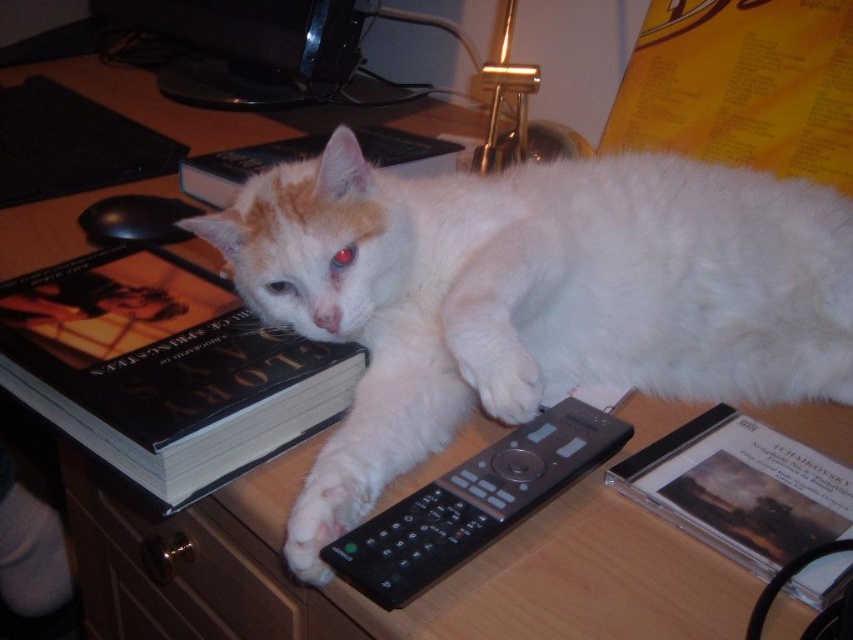
Which is below, matte plastic cd case at lower right or black plastic remote at center?

matte plastic cd case at lower right

Is matte plastic cd case at lower right smaller than black plastic remote at center?

Yes.

Between point (654, 506) and point (418, 515), which one is positioned behind?

The point (654, 506) is behind.

Find the location of a particular element. Image resolution: width=853 pixels, height=640 pixels. matte plastic cd case at lower right is located at coordinates (740, 488).

Who is positioned more to the left, black hardcover book at upper left or matte plastic cd case at lower right?

black hardcover book at upper left is more to the left.

Does black hardcover book at upper left appear on the right side of matte plastic cd case at lower right?

No, black hardcover book at upper left is not to the right of matte plastic cd case at lower right.

Which is in front, point (131, 460) or point (770, 467)?

Point (131, 460) is in front.

Where is `black hardcover book at upper left`? The height and width of the screenshot is (640, 853). black hardcover book at upper left is located at coordinates (164, 369).

Describe the element at coordinates (740, 488) in the screenshot. The height and width of the screenshot is (640, 853). I see `matte plastic cd case at lower right` at that location.

Is matte plastic cd case at lower right smaller than hardcover book at upper left?

Yes.

Where is `matte plastic cd case at lower right`? Image resolution: width=853 pixels, height=640 pixels. matte plastic cd case at lower right is located at coordinates (740, 488).